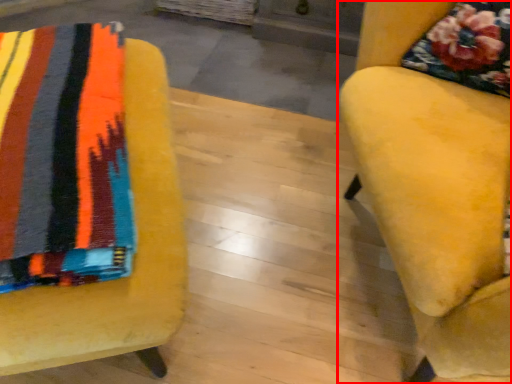
Question: Observing the image, what is the correct spatial positioning of chair (annotated by the red box) in reference to chair?

Choices:
 (A) left
 (B) right

Answer: (B)